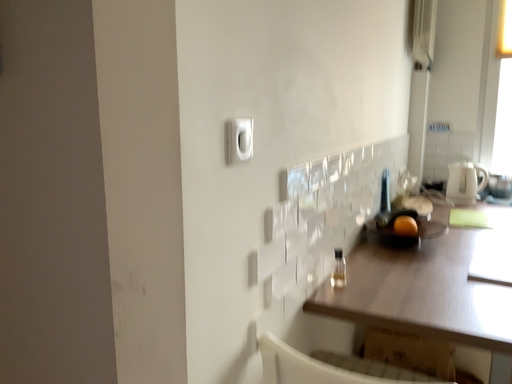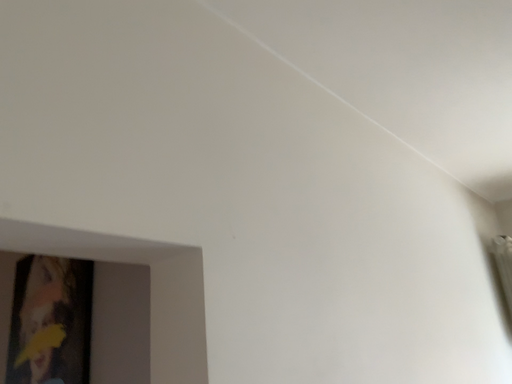
Question: How did the camera likely rotate when shooting the video?

Choices:
 (A) rotated downward
 (B) rotated upward

Answer: (B)